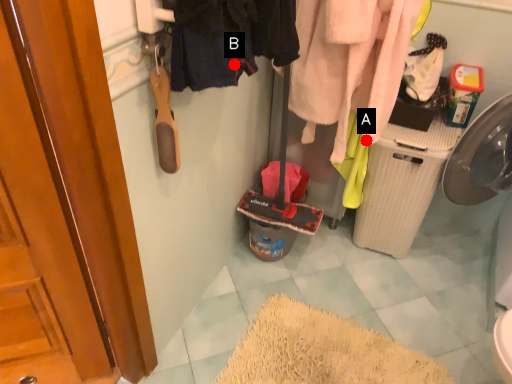
Question: Two points are circled on the image, labeled by A and B beside each circle. Which point is farther to the camera?

Choices:
 (A) A is further
 (B) B is further

Answer: (A)